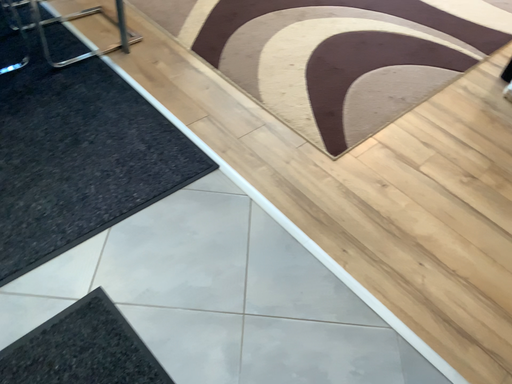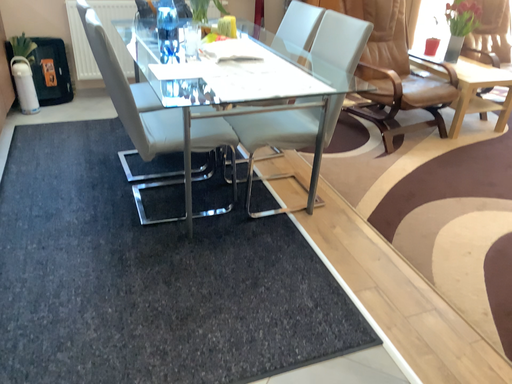
Question: Which way did the camera rotate in the video?

Choices:
 (A) rotated downward
 (B) rotated upward

Answer: (B)